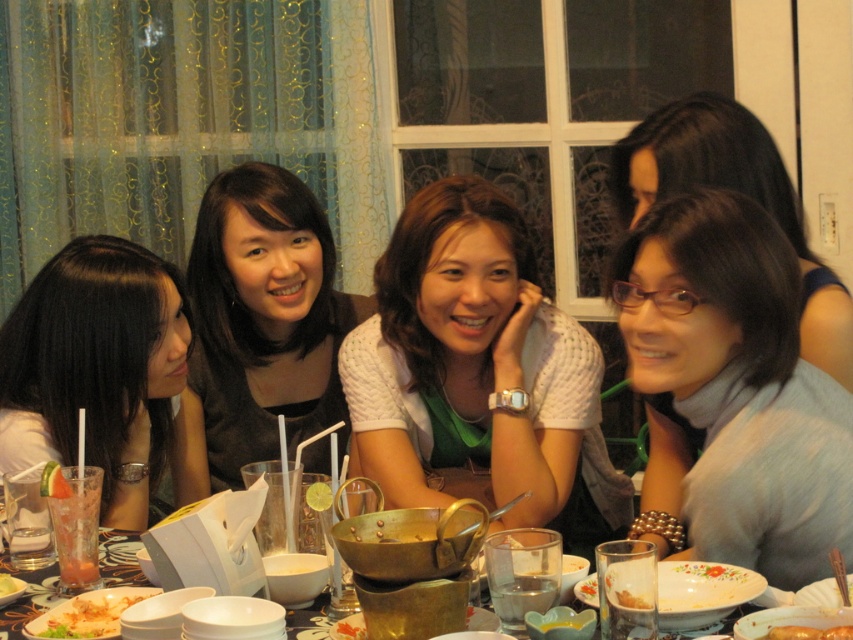
You are a server at a restaurant and need to place a new dish on the table. The dish must be placed to the left of the light blue turtleneck sweater at center. Is there space available on the table for this placement near the white glossy plate at lower left?

The light blue turtleneck sweater at center is to the right of the white glossy plate at lower left, so placing the new dish to the left of the light blue turtleneck sweater at center would be near the white glossy plate at lower left. Since the white glossy plate at lower left is already positioned there, there may not be sufficient space available for the new dish unless items are moved.

You are a server who needs to place a new dish on the table between the smooth brown sausage at center and the smooth white bowl at center. The dish is 1 meter in diameter. Can you fit it between them without moving any existing items?

The distance between the smooth brown sausage at center and the smooth white bowl at center is 1.13 meters. Since the dish is 1 meter in diameter, it can fit between them as the space available is larger than the dish.